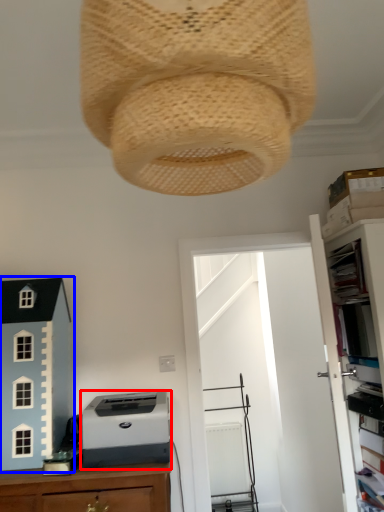
Question: Which object is closer to the camera taking this photo, printer (highlighted by a red box) or toy (highlighted by a blue box)?

Choices:
 (A) printer
 (B) toy

Answer: (A)